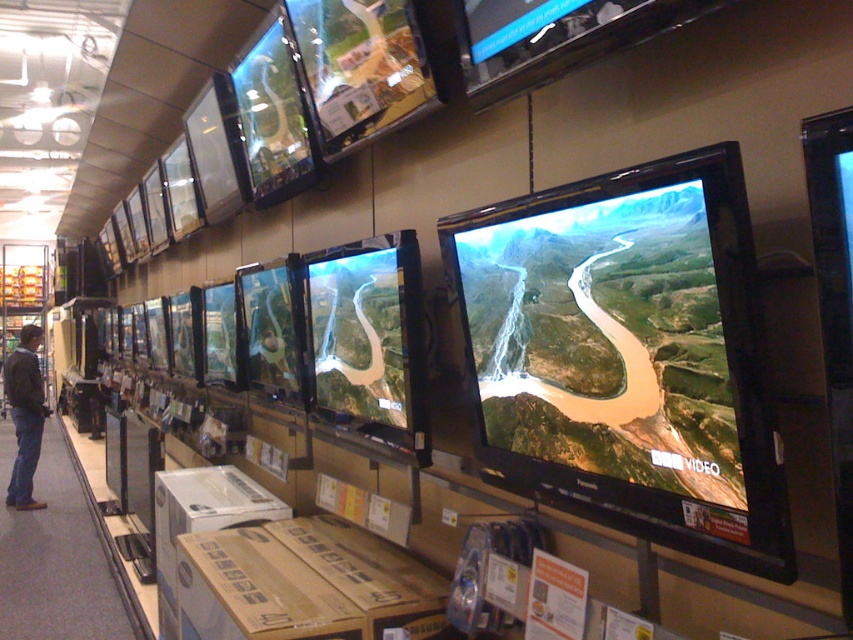
Consider the image. You are a customer in the electronics store looking at the satin black flat screen at center. You notice a dark gray jacket at left nearby. From your perspective, which object is closer to you?

The satin black flat screen at center is closer to you because it is in front of the dark gray jacket at left.

You are a customer in the electronics store and want to compare the width of the satin black flat screen at center and the dark gray jacket at left. Which object is wider?

The satin black flat screen at center has a lesser width compared to dark gray jacket at left, so the dark gray jacket at left is wider.